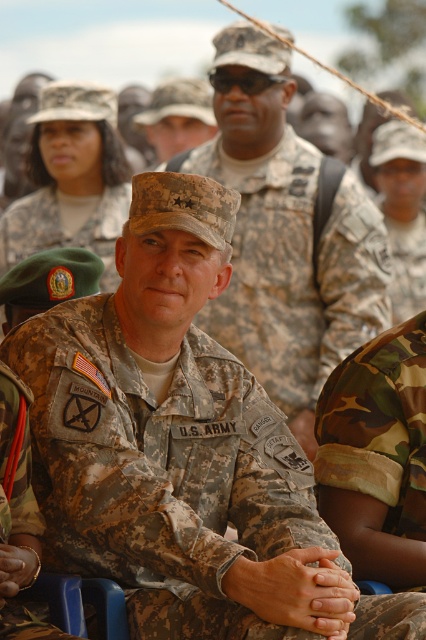
Question: Which object is farther from the camera taking this photo?

Choices:
 (A) green beret at center
 (B) camouflage uniform at center

Answer: (A)

Question: From the image, what is the correct spatial relationship of camouflage uniform at center in relation to camouflage fabric uniform at center?

Choices:
 (A) right
 (B) left

Answer: (B)

Question: Does camouflage fabric us army uniform at center appear on the right side of camouflage uniform at center?

Choices:
 (A) no
 (B) yes

Answer: (A)

Question: Can you confirm if camouflage fabric us army uniform at center is positioned above green beret at center?

Choices:
 (A) no
 (B) yes

Answer: (A)

Question: Among these objects, which one is nearest to the camera?

Choices:
 (A) camouflage fabric us army uniform at center
 (B) green beret at center
 (C) camouflage uniform at center
 (D) camouflage fabric uniform at center

Answer: (A)

Question: Which object appears closest to the camera in this image?

Choices:
 (A) camouflage uniform at center
 (B) camouflage fabric uniform at center
 (C) green beret at center
 (D) camouflage fabric us army uniform at center

Answer: (D)